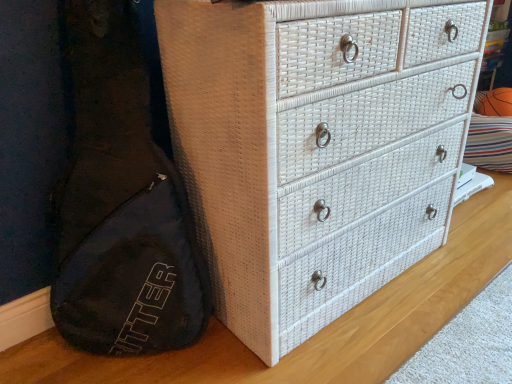
Question: Is orange rubber basketball at upper right in front of or behind white wicker chest of drawers at center in the image?

Choices:
 (A) front
 (B) behind

Answer: (B)

Question: Considering the positions of point (506, 89) and point (296, 244), is point (506, 89) closer or farther from the camera than point (296, 244)?

Choices:
 (A) farther
 (B) closer

Answer: (A)

Question: Is orange rubber basketball at upper right situated inside white wicker chest of drawers at center or outside?

Choices:
 (A) outside
 (B) inside

Answer: (A)

Question: From a real-world perspective, is white wicker chest of drawers at center positioned above or below orange rubber basketball at upper right?

Choices:
 (A) below
 (B) above

Answer: (B)

Question: Considering the positions of white wicker chest of drawers at center and orange rubber basketball at upper right in the image, is white wicker chest of drawers at center wider or thinner than orange rubber basketball at upper right?

Choices:
 (A) thin
 (B) wide

Answer: (B)

Question: Is point (242, 135) positioned closer to the camera than point (483, 94)?

Choices:
 (A) farther
 (B) closer

Answer: (B)

Question: In the image, is white wicker chest of drawers at center positioned in front of or behind orange rubber basketball at upper right?

Choices:
 (A) behind
 (B) front

Answer: (B)